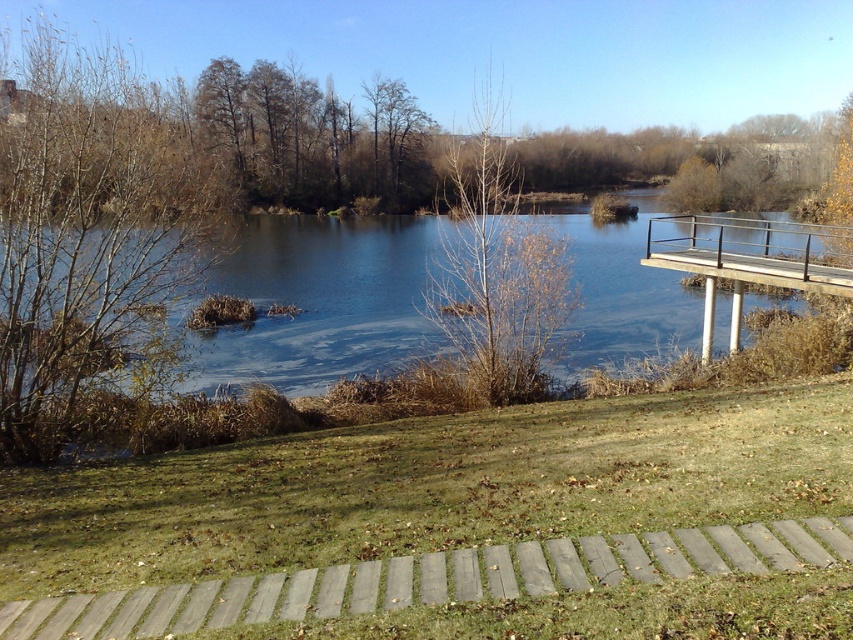
Measure the distance from bare branches at center to brown wooden bridge at right.

The distance of bare branches at center from brown wooden bridge at right is 13.18 meters.

Find the location of a particular element. bare branches at center is located at coordinates (497, 268).

This screenshot has height=640, width=853. Describe the element at coordinates (497, 268) in the screenshot. I see `bare branches at center` at that location.

Identify the location of bare branches at center. The width and height of the screenshot is (853, 640). (497, 268).

Is point (65, 420) farther from camera compared to point (553, 337)?

No.

This screenshot has height=640, width=853. I want to click on brown leafy tree at left, so click(93, 236).

The height and width of the screenshot is (640, 853). In order to click on brown leafy tree at left in this screenshot , I will do `click(93, 236)`.

Based on the photo, does blue water at center have a larger size compared to bare branches at center?

Yes.

Is point (268, 216) closer to camera compared to point (514, 340)?

No, it is behind (514, 340).

At what (x,y) coordinates should I click in order to perform the action: click on blue water at center. Please return your answer as a coordinate pair (x, y). Looking at the image, I should click on [320, 301].